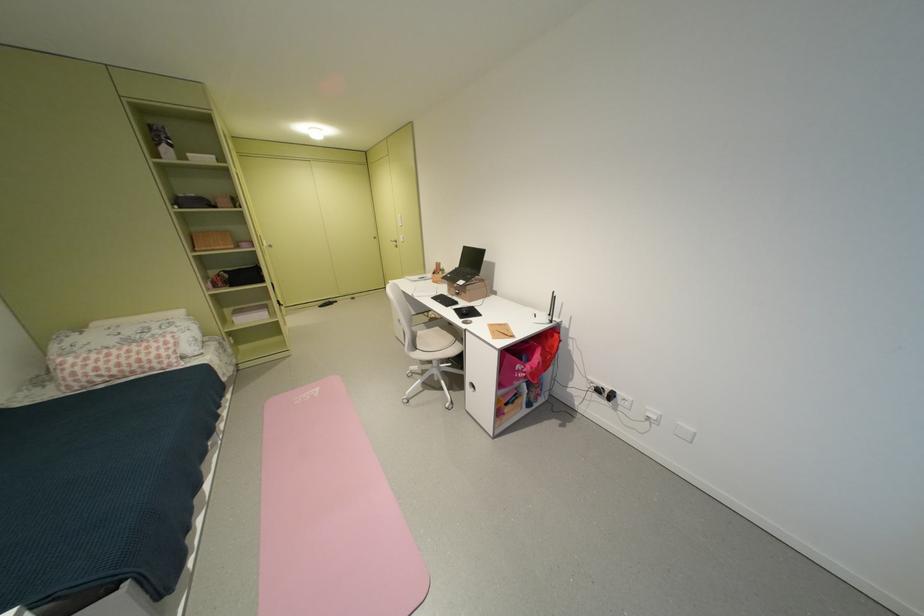
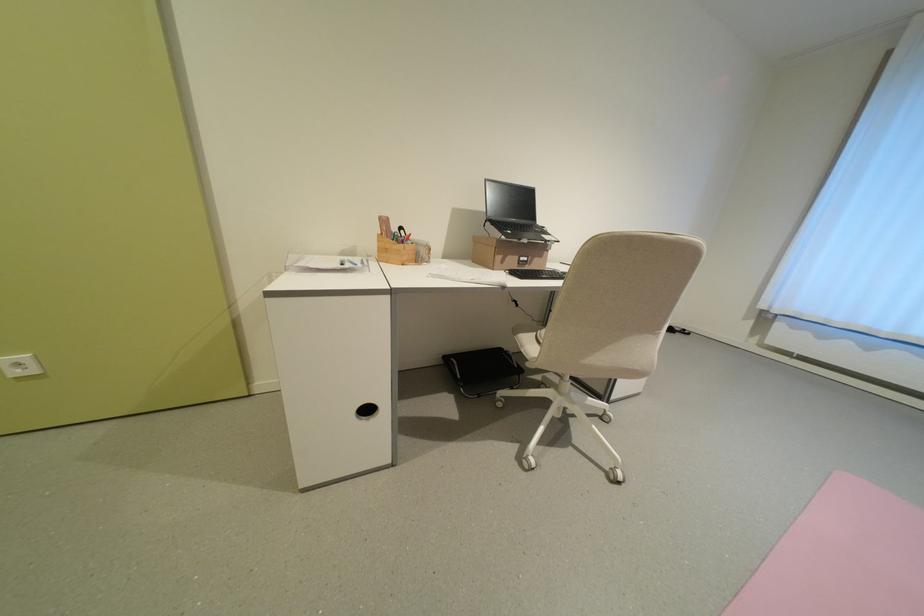
Where in the second image is the point corresponding to point 468,293 from the first image?

(536, 261)